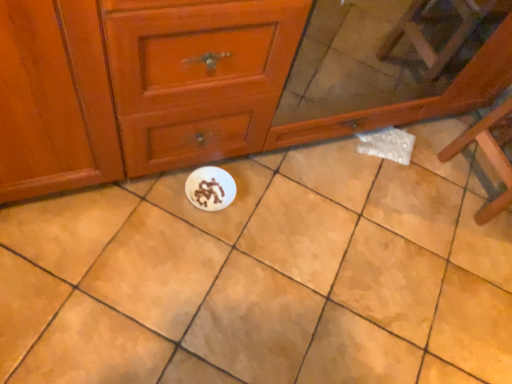
The image size is (512, 384). Identify the location of vacant space behind white matte paper plate at center. (247, 172).